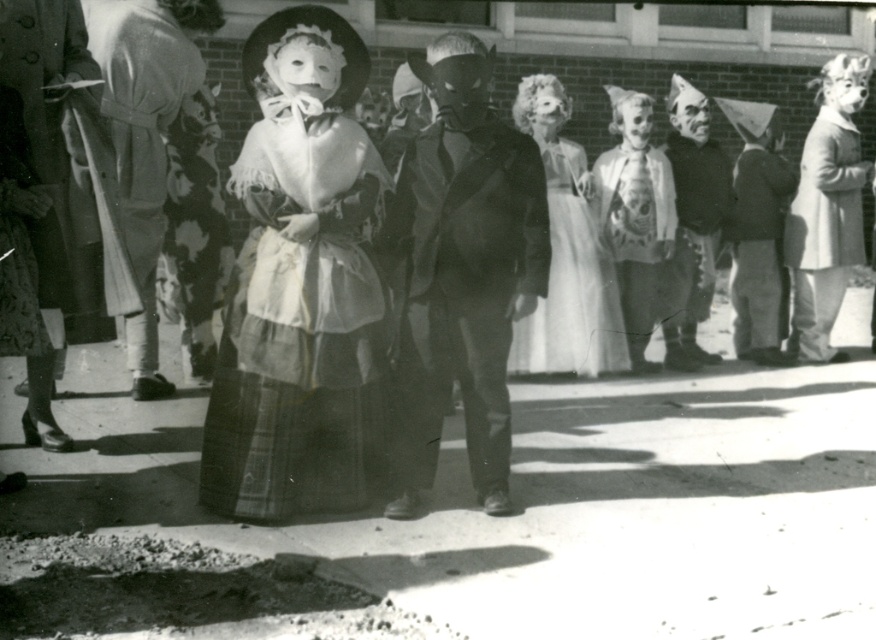
Question: Which object appears farthest from the camera in this image?

Choices:
 (A) light beige wool coat at right
 (B) matte floral dress at center
 (C) plaid wool dress at center
 (D) white lace dress at center

Answer: (A)

Question: Can you confirm if smooth beige coat at right is positioned to the right of white lace dress at center?

Choices:
 (A) yes
 (B) no

Answer: (A)

Question: Is matte black mask at center positioned in front of matte brown paper bag at center?

Choices:
 (A) yes
 (B) no

Answer: (A)

Question: Among these points, which one is farthest from the camera?

Choices:
 (A) (672, 276)
 (B) (1, 84)

Answer: (A)

Question: Which point is closer to the camera?

Choices:
 (A) white lace dress at center
 (B) matte black mask at center

Answer: (A)

Question: Can you confirm if matte black mask at center is thinner than plaid wool dress at left?

Choices:
 (A) yes
 (B) no

Answer: (B)